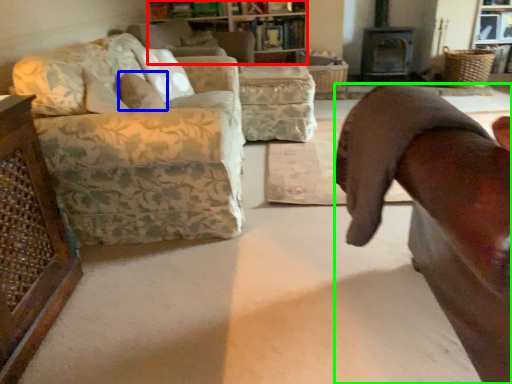
Question: Considering the real-world distances, which object is farthest from cabinetry (highlighted by a red box)? pillow (highlighted by a blue box) or chair (highlighted by a green box)?

Choices:
 (A) pillow
 (B) chair

Answer: (B)